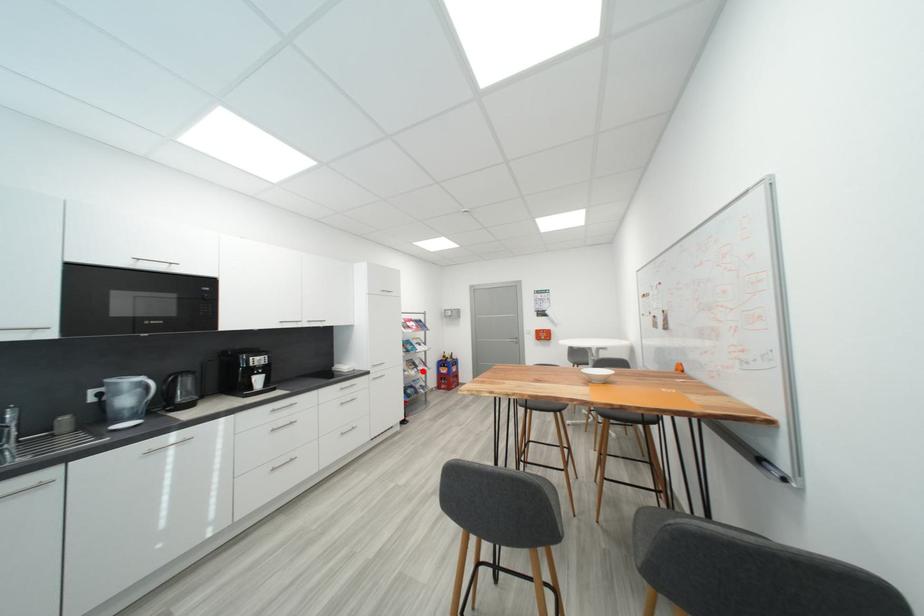
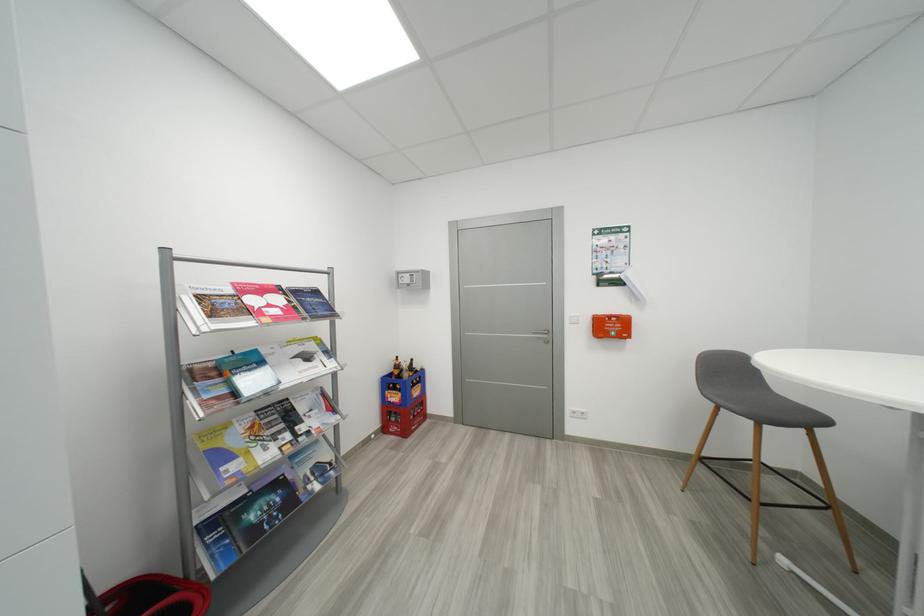
Question: I am providing you with two images of the same scene from different viewpoints. Given a red point in image1, look at the same physical point in image2. Is it:

Choices:
 (A) Closer to the viewpoint
 (B) Farther from the viewpoint

Answer: (A)